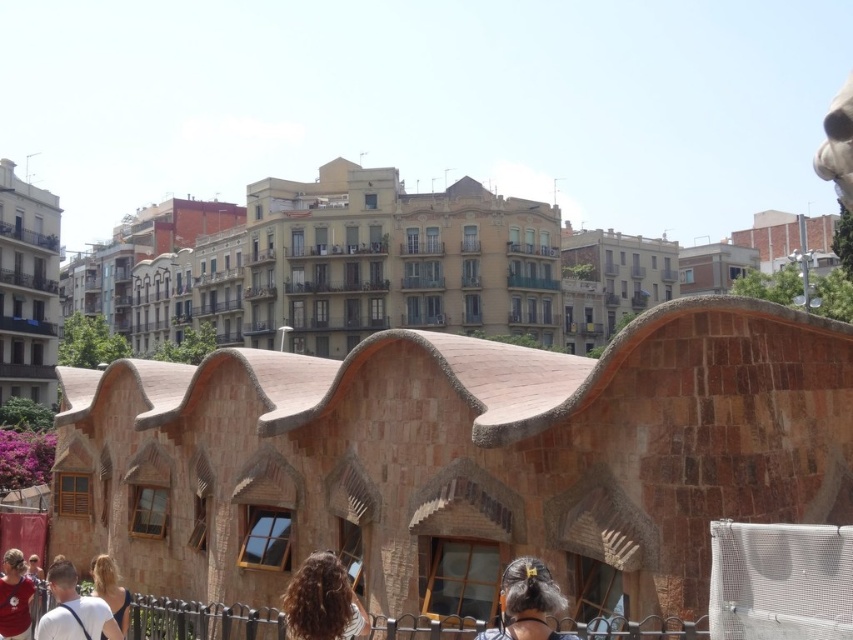
Can you confirm if matte red shirt at lower left is positioned to the right of light brown hair at lower center?

Indeed, matte red shirt at lower left is positioned on the right side of light brown hair at lower center.

You are a GUI agent. You are given a task and a screenshot of the screen. Output one action in this format:
    pyautogui.click(x=<x>, y=<y>)
    Task: Click on the matte red shirt at lower left
    
    Given the screenshot: What is the action you would take?
    pyautogui.click(x=15, y=596)

Is curly hair at center positioned behind light brown hair at lower center?

No, curly hair at center is closer to the viewer.

How far apart are curly hair at center and light brown hair at lower center?

curly hair at center is 52.58 feet from light brown hair at lower center.

Does point (323, 579) come closer to viewer compared to point (39, 561)?

Yes.

The image size is (853, 640). Find the location of `curly hair at center`. curly hair at center is located at coordinates (322, 600).

Looking at this image, does white fur at upper right have a smaller size compared to matte red shirt at lower left?

No.

Can you confirm if white fur at upper right is thinner than matte red shirt at lower left?

No.

Between point (828, 168) and point (28, 609), which one is positioned behind?

Point (28, 609)

What are the coordinates of `white fur at upper right` in the screenshot? It's located at (837, 145).